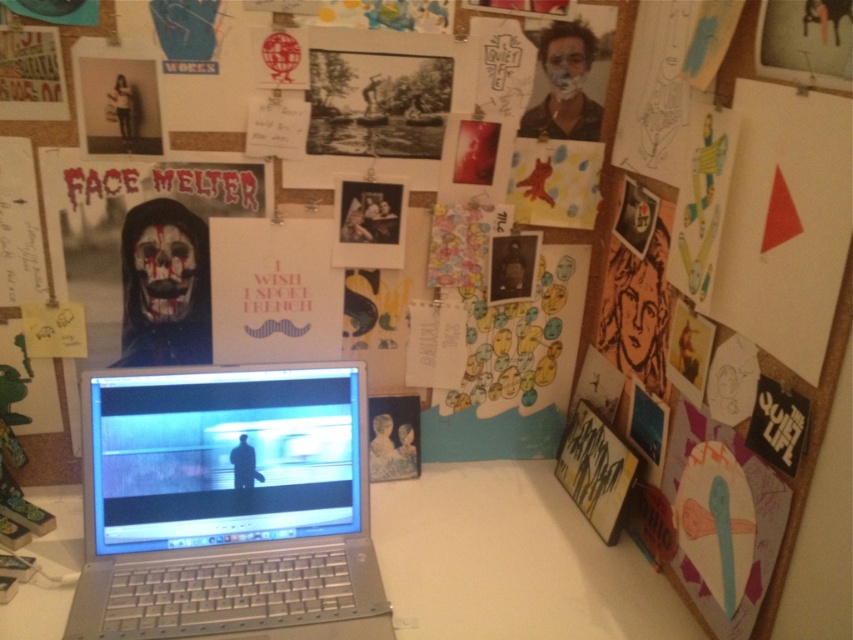
You have a rectangular object that is 1.2 meters wide. You want to place it on the white plastic table at center. Can the silver metallic laptop at center currently on the table be moved to make space?

The silver metallic laptop at center has a width less than the white plastic table at center, so moving it would free up enough space for the 1.2 meter wide object.

You are setting up a desk in your home office and want to ensure that all items fit properly. You have a silver metallic laptop at center and a white plastic table at center. Which item is taller?

The silver metallic laptop at center is taller than the white plastic table at center.

You are standing 1 meter away from the corkboard wall. You want to hang a small picture frame exactly at point (303, 416). Can you reach that point with your arm if your arm length is 0.7 meters?

The distance of point (303, 416) from viewer is 1.07 meters. Since your arm is only 0.7 meters long, you cannot reach the point (303, 416) which is 1.07 meters away from you.